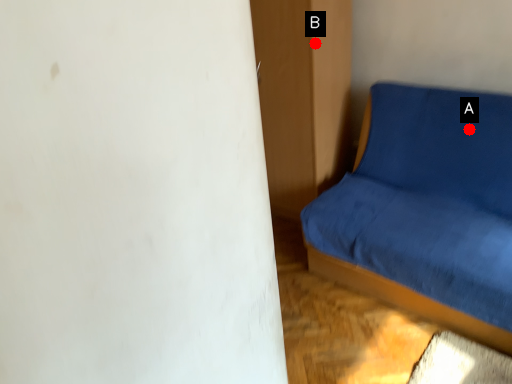
Question: Two points are circled on the image, labeled by A and B beside each circle. Which of the following is the farthest from the observer?

Choices:
 (A) A is further
 (B) B is further

Answer: (B)